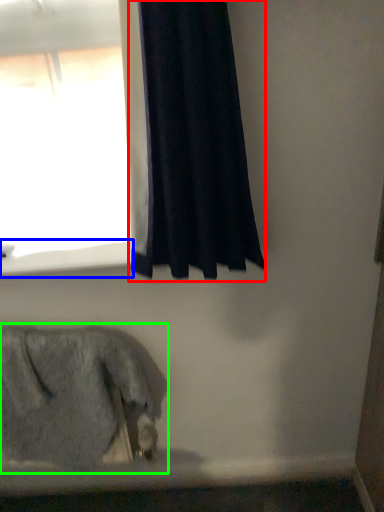
Question: Which object is the closest to the curtain (highlighted by a red box)? Choose among these: window sill (highlighted by a blue box) or animal (highlighted by a green box).

Choices:
 (A) window sill
 (B) animal

Answer: (A)